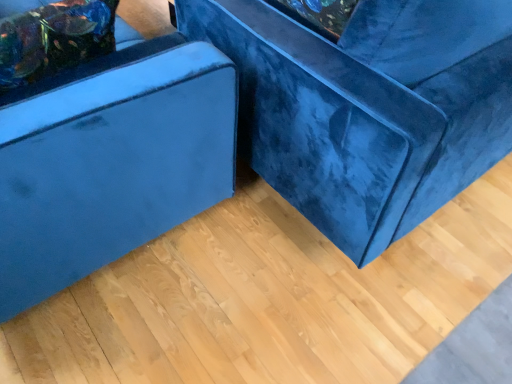
Question: Which is correct: velvet blue ottoman at left, the second furniture in the right-to-left sequence, is inside velvet blue couch at center, the second furniture in the left-to-right sequence, or outside of it?

Choices:
 (A) outside
 (B) inside

Answer: (A)

Question: In terms of height, does velvet blue ottoman at left, the second furniture in the right-to-left sequence, look taller or shorter compared to velvet blue couch at center, which ranks as the 1th furniture in right-to-left order?

Choices:
 (A) tall
 (B) short

Answer: (B)

Question: Estimate the real-world distances between objects in this image. Which object is closer to the velvet blue ottoman at left, which ranks as the 1th furniture in left-to-right order?

Choices:
 (A) velvet blue pillow at upper left
 (B) velvet blue couch at center, the second furniture in the left-to-right sequence

Answer: (A)

Question: Estimate the real-world distances between objects in this image. Which object is farther from the velvet blue pillow at upper left?

Choices:
 (A) velvet blue couch at center, the second furniture in the left-to-right sequence
 (B) velvet blue ottoman at left, the second furniture in the right-to-left sequence

Answer: (A)